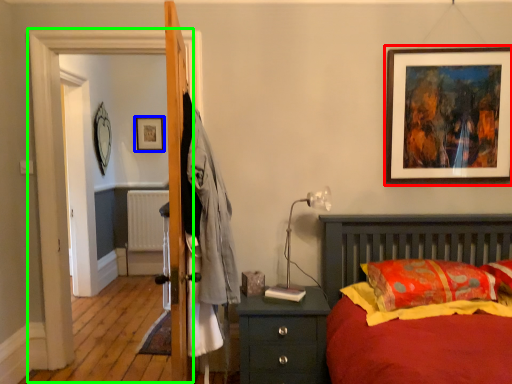
Question: Which object is the farthest from picture frame (highlighted by a red box)? Choose among these: picture frame (highlighted by a blue box) or screen door (highlighted by a green box).

Choices:
 (A) picture frame
 (B) screen door

Answer: (A)